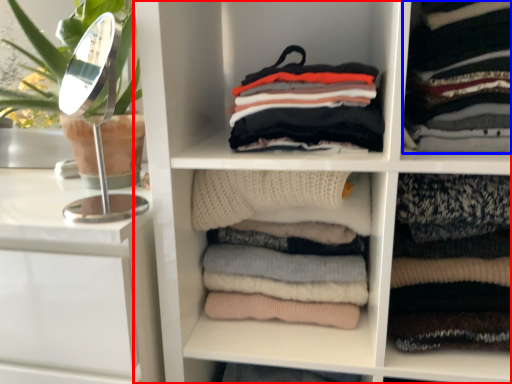
Question: Which of the following is the farthest to the observer, shelf (highlighted by a red box) or clothing (highlighted by a blue box)?

Choices:
 (A) shelf
 (B) clothing

Answer: (B)